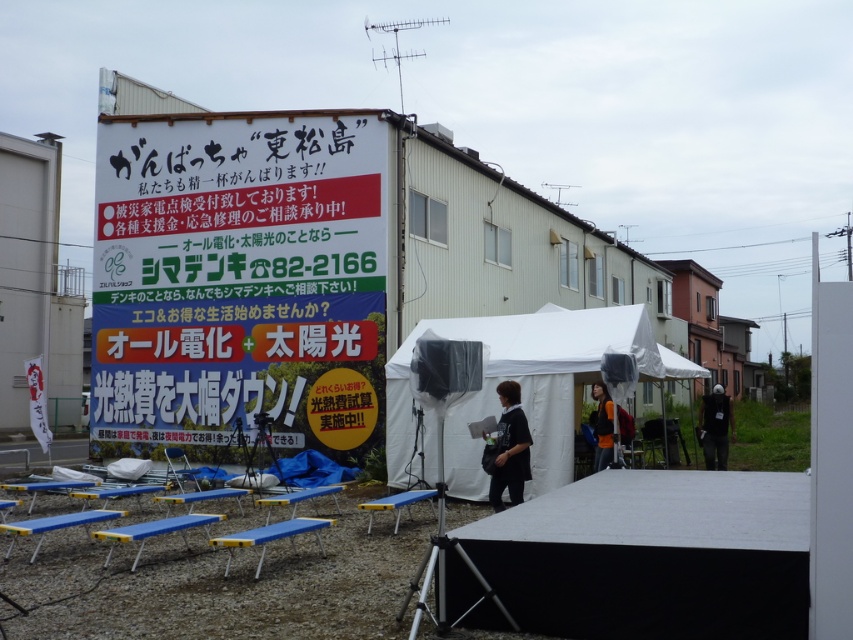
You are setting up for an event and need to place a 6 feet long banner between the white fabric canopy at center and the orange fabric jacket at center. Can you fit it there?

The distance between the white fabric canopy at center and the orange fabric jacket at center is 5.93 feet, which is slightly shorter than the 6 feet long banner. Therefore, the banner cannot be placed between them without overlapping or bending.

From the picture: You are standing in front of the signboard and want to walk towards the two points marked in the image. Which point, point (451, 324) or point (602, 404), will you reach first?

Point (451, 324) is closer to you than point (602, 404), so you will reach point (451, 324) first.

In the scene shown: You are standing in front of the signboard and want to take a photo. You notice two points marked in the image. Which point, point (451, 483) or point (730, 410), is closer to your camera lens?

Point (451, 483) is closer to the camera lens than point (730, 410).